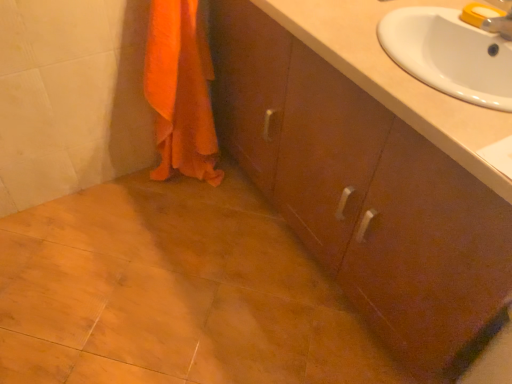
Image resolution: width=512 pixels, height=384 pixels. I want to click on unoccupied region to the right of orange fabric towel at lower left, so click(238, 193).